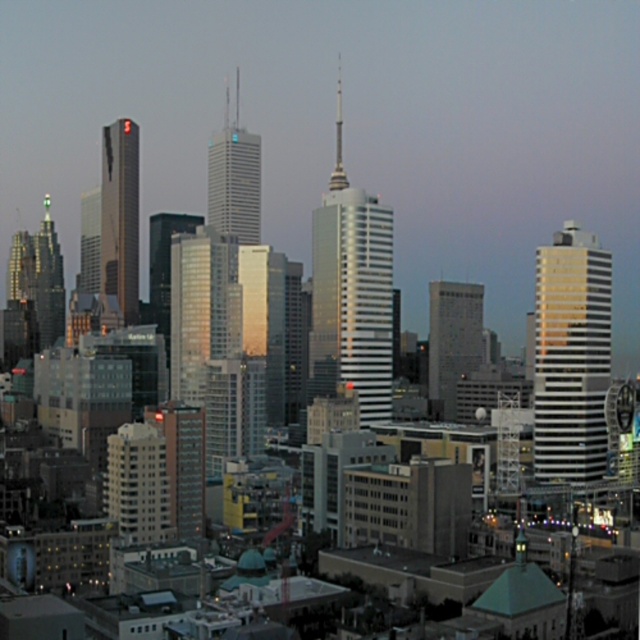
Question: Which object is farther from the camera taking this photo?

Choices:
 (A) shiny silver skyscraper at center
 (B) shiny silver spire at center-left

Answer: (B)

Question: From the image, what is the correct spatial relationship of silver glass skyscraper at center in relation to reflective glass skyscraper at center?

Choices:
 (A) right
 (B) left

Answer: (B)

Question: Which point is closer to the camera?

Choices:
 (A) silver glass skyscraper at center
 (B) shiny glass skyscraper at upper left

Answer: (A)

Question: Is shiny glass skyscraper at upper left positioned before reflective glass skyscraper at center?

Choices:
 (A) no
 (B) yes

Answer: (A)

Question: Which object is the closest to the silver glass skyscraper at center?

Choices:
 (A) reflective glass skyscraper at center
 (B) shiny silver spire at center-left

Answer: (B)

Question: Observing the image, what is the correct spatial positioning of white glossy building at right in reference to shiny glass skyscraper at upper left?

Choices:
 (A) right
 (B) left

Answer: (A)